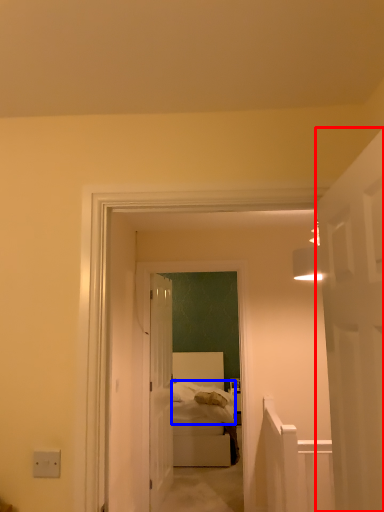
Question: Which of the following is the farthest to the observer, door (highlighted by a red box) or bedding (highlighted by a blue box)?

Choices:
 (A) door
 (B) bedding

Answer: (B)